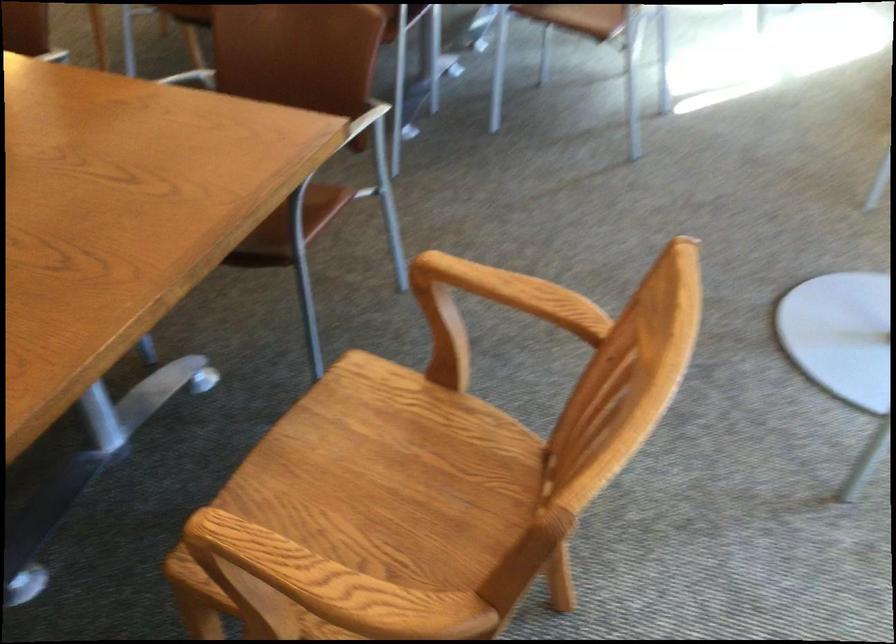
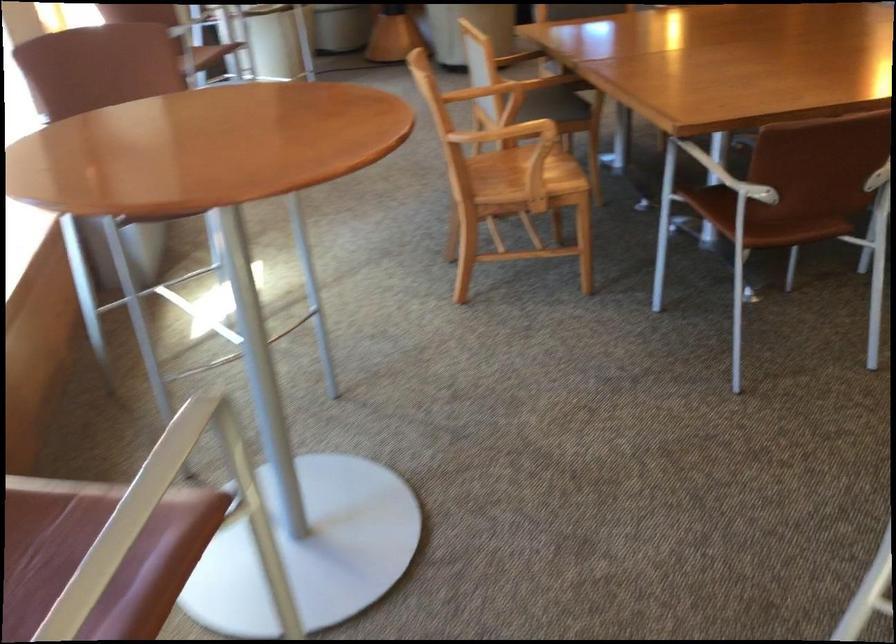
Question: I am providing you with two images of the same scene from different viewpoints. Which of the following objects are not visible in image2?

Choices:
 (A) white chair armrest
 (B) brown chair sitting surface
 (C) black mouse
 (D) wooden chair armrest

Answer: (D)